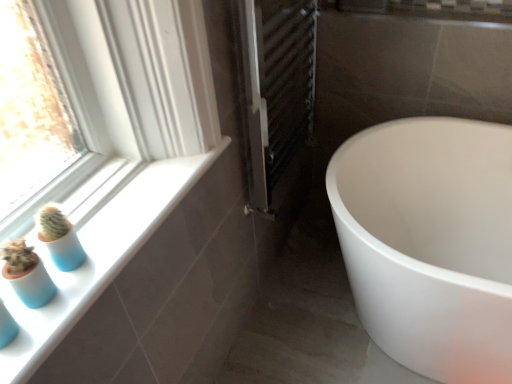
You are a GUI agent. You are given a task and a screenshot of the screen. Output one action in this format:
    pyautogui.click(x=<x>, y=<y>)
    Task: Click on the free space underneath metallic silver radiator at center (from a real-world perspective)
    
    Given the screenshot: What is the action you would take?
    pyautogui.click(x=297, y=246)